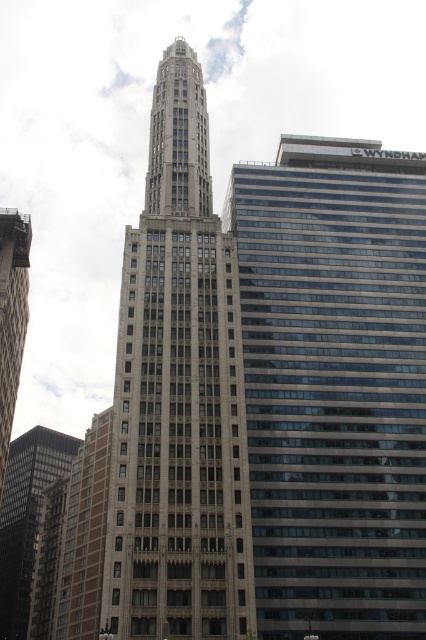
Who is positioned more to the left, gray stone tower at center or matte glass skyscraper at left?

From the viewer's perspective, matte glass skyscraper at left appears more on the left side.

Is gray stone tower at center thinner than matte glass skyscraper at left?

Yes, gray stone tower at center is thinner than matte glass skyscraper at left.

Who is more forward, (189, 257) or (0, 403)?

Point (189, 257) is in front.

This screenshot has width=426, height=640. In order to click on gray stone tower at center in this screenshot , I will do `click(178, 396)`.

Can you confirm if glassy steel skyscraper at center is taller than gray stone tower at center?

No, glassy steel skyscraper at center is not taller than gray stone tower at center.

Is glassy steel skyscraper at center further to camera compared to gray stone tower at center?

Yes, glassy steel skyscraper at center is behind gray stone tower at center.

Identify the location of glassy steel skyscraper at center. (333, 385).

Locate an element on the screen. glassy steel skyscraper at center is located at coordinates (333, 385).

Where is `glassy steel skyscraper at center`? glassy steel skyscraper at center is located at coordinates (333, 385).

Is the position of glassy steel skyscraper at center more distant than that of dark gray stone tower at lower left?

No, glassy steel skyscraper at center is in front of dark gray stone tower at lower left.

Does point (322, 349) come in front of point (20, 454)?

Yes, point (322, 349) is in front of point (20, 454).

The image size is (426, 640). What are the coordinates of `glassy steel skyscraper at center` in the screenshot? It's located at (333, 385).